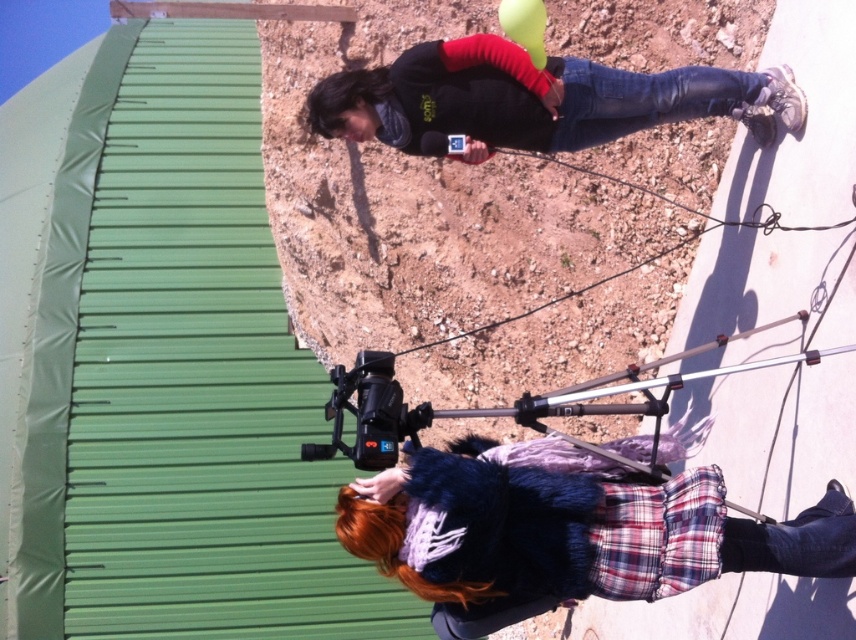
You are a costume designer preparing for a photoshoot. You have two jackets to place on a rack. The fluffy blue coat at lower center and the dark gray fleece jacket at upper center. Which jacket should you choose if you want to cover more body area?

The dark gray fleece jacket at upper center is wider than the fluffy blue coat at lower center, so it would cover more body area.

You are standing in the scene and want to toss a small ball to the fluffy blue coat at lower center. Considering the distance provided, would you need to throw it with significant force or can you just gently roll it?

The fluffy blue coat at lower center is 20.69 meters away from the viewer. Since this distance is quite far, you would need to throw the ball with significant force to reach it, as gently rolling it would not cover such a distance.